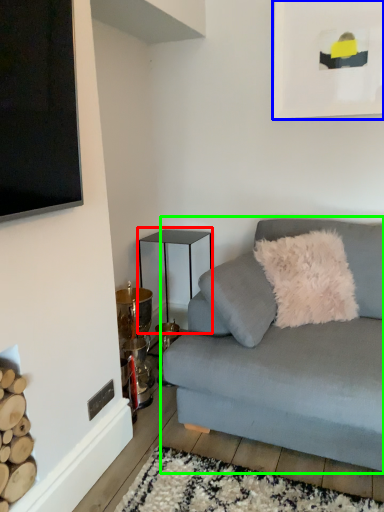
Question: Which object is the farthest from table (highlighted by a red box)? Choose among these: picture frame (highlighted by a blue box) or studio couch (highlighted by a green box).

Choices:
 (A) picture frame
 (B) studio couch

Answer: (A)